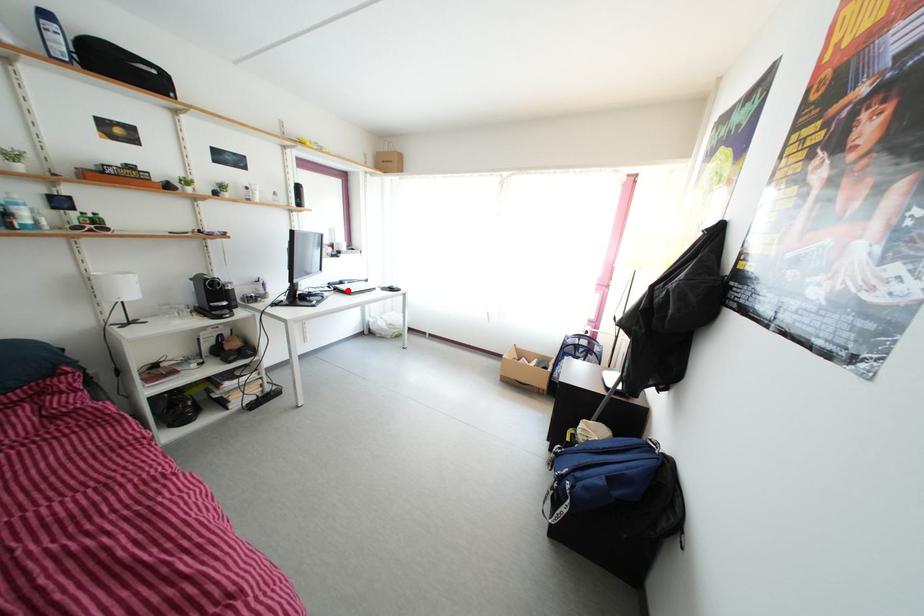
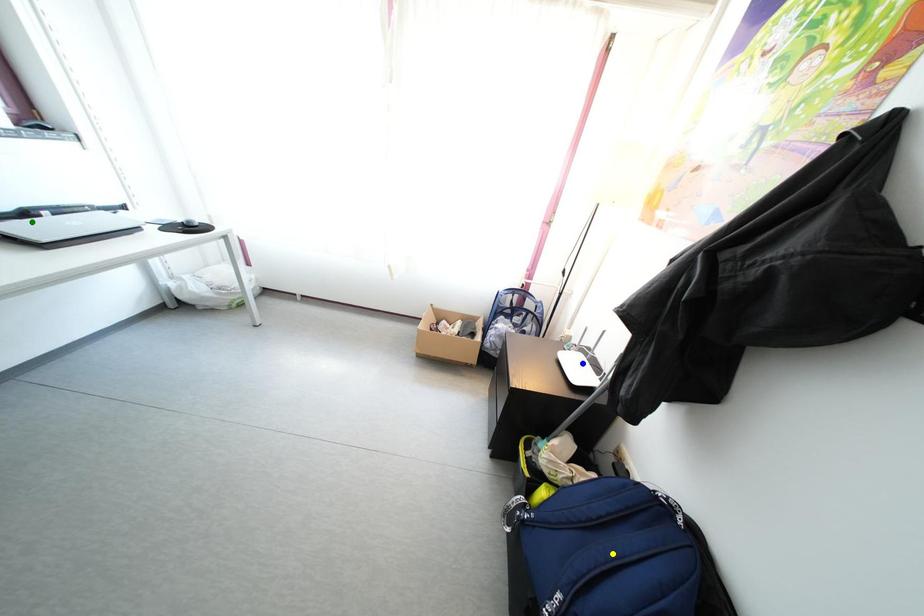
Question: I am providing you with two images of the same scene from different viewpoints. A red point is marked on the first image. You are given multiple points on the second image. Which point in image 2 represents the same 3d spot as the red point in image 1?

Choices:
 (A) blue point
 (B) yellow point
 (C) green point

Answer: (C)